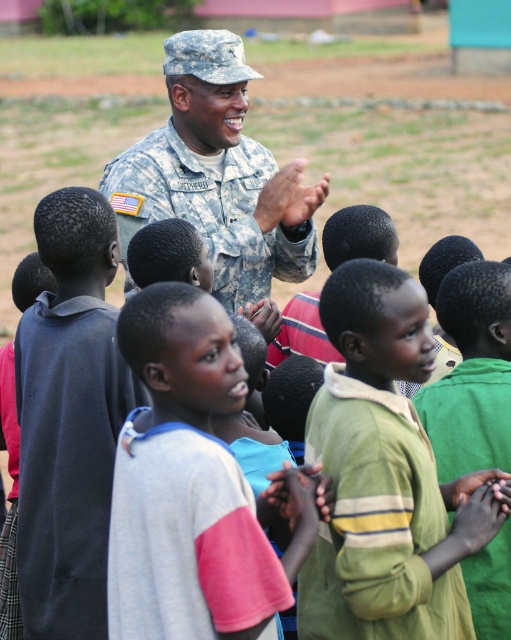
Question: Does dark blue hoodie at center have a lesser width compared to camouflage uniform at center?

Choices:
 (A) yes
 (B) no

Answer: (A)

Question: Can you confirm if gray cotton shirt at center is positioned below green textured shirt at center?

Choices:
 (A) yes
 (B) no

Answer: (A)

Question: Is camouflage uniform at center closer to camera compared to green textured shirt at center?

Choices:
 (A) no
 (B) yes

Answer: (A)

Question: Estimate the real-world distances between objects in this image. Which object is closer to the green cotton shirt at center?

Choices:
 (A) gray cotton shirt at center
 (B) camouflage uniform at center
 (C) green textured shirt at center
 (D) dark blue hoodie at center

Answer: (A)

Question: Which point is farther to the camera?

Choices:
 (A) (236, 236)
 (B) (201, 355)
 (C) (462, 460)
 (D) (405, 621)

Answer: (A)

Question: Which object is farther from the camera taking this photo?

Choices:
 (A) dark blue hoodie at center
 (B) green textured shirt at center
 (C) camouflage uniform at center

Answer: (C)